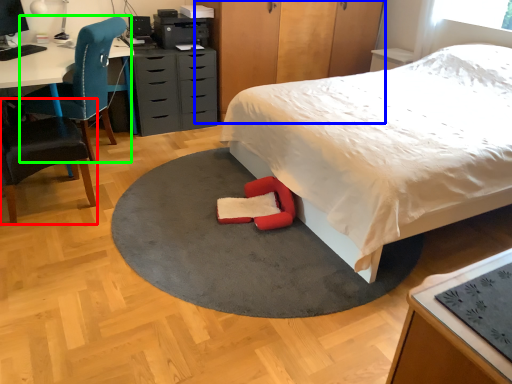
Question: Based on their relative distances, which object is nearer to chair (highlighted by a red box)? Choose from dresser (highlighted by a blue box) and chair (highlighted by a green box).

Choices:
 (A) dresser
 (B) chair

Answer: (B)